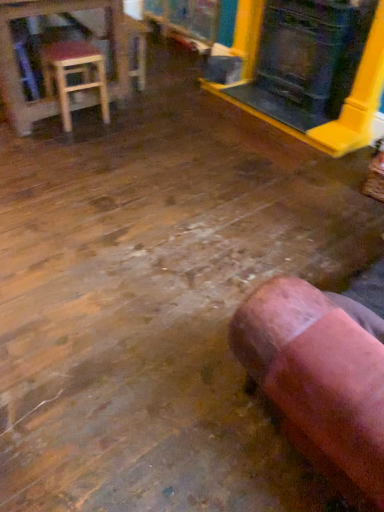
Question: Is matte black fireplace at upper right taller or shorter than wooden stool at left?

Choices:
 (A) short
 (B) tall

Answer: (B)

Question: In the image, is matte black fireplace at upper right positioned in front of or behind wooden stool at left?

Choices:
 (A) front
 (B) behind

Answer: (A)

Question: Which is nearer to the wooden stool at upper left?

Choices:
 (A) matte black fireplace at upper right
 (B) wooden stool at left
 (C) pink suede bean bag chair at lower right

Answer: (B)

Question: Which object is the farthest from the matte black fireplace at upper right?

Choices:
 (A) pink suede bean bag chair at lower right
 (B) wooden stool at upper left
 (C) wooden stool at left

Answer: (A)